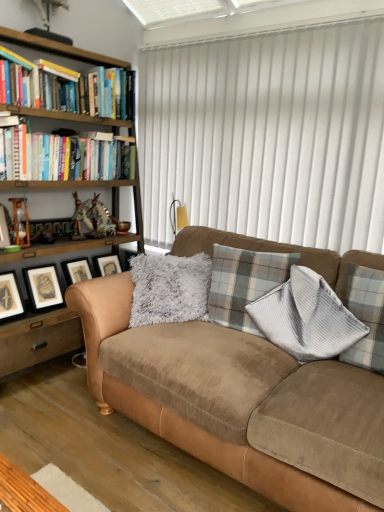
Question: Looking at the image, does hardcover books at left seem bigger or smaller compared to wooden bookshelf at left?

Choices:
 (A) small
 (B) big

Answer: (A)

Question: Would you say hardcover books at left is to the left or to the right of wooden bookshelf at left in the picture?

Choices:
 (A) right
 (B) left

Answer: (A)

Question: Which object is the farthest from the suede couch at center?

Choices:
 (A) hardcover books at left
 (B) wooden bookshelf at left
 (C) white vertical blinds at upper center
 (D) wooden picture frame at left, positioned as the first picture frame in front-to-back order
 (E) plaid fabric pillow at center

Answer: (D)

Question: Estimate the real-world distances between objects in this image. Which object is closer to the plaid fabric pillow at center?

Choices:
 (A) suede couch at center
 (B) black matte picture frame at lower left, acting as the 2th picture frame starting from the top
 (C) white vertical blinds at upper center
 (D) wooden picture frame at left, marked as the first picture frame in a left-to-right arrangement
 (E) wooden bookshelf at left

Answer: (A)